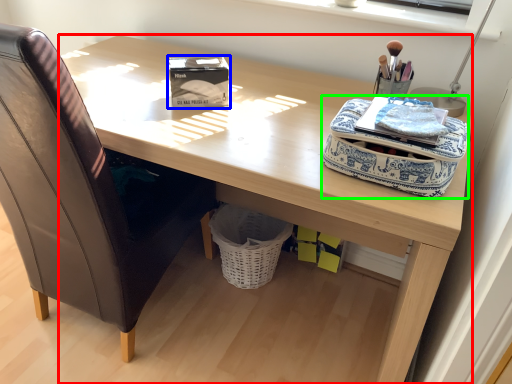
Question: Estimate the real-world distances between objects in this image. Which object is farther from desk (highlighted by a red box), box (highlighted by a blue box) or bag (highlighted by a green box)?

Choices:
 (A) box
 (B) bag

Answer: (B)